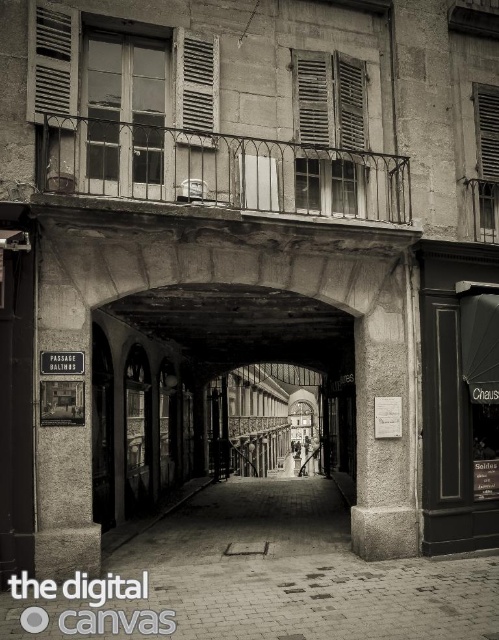
Question: Can you confirm if wooden slats at upper center is thinner than matte wood shutter at upper left?

Choices:
 (A) no
 (B) yes

Answer: (A)

Question: Estimate the real-world distances between objects in this image. Which object is farther from the smooth stone pillar at left?

Choices:
 (A) matte wood shutter at upper right
 (B) matte wood shutter at upper center

Answer: (A)

Question: Which object is positioned farthest from the white matte shutter at center?

Choices:
 (A) wooden slats at upper center
 (B) smooth stone pillar at left
 (C) matte wood shutter at upper right

Answer: (C)

Question: Among these objects, which one is farthest from the camera?

Choices:
 (A) smooth stone pillar at left
 (B) matte wood shutter at upper left

Answer: (B)

Question: Is smooth stone pillar at left thinner than matte wood shutter at upper center?

Choices:
 (A) yes
 (B) no

Answer: (B)

Question: Does matte wood shutter at upper right appear on the right side of white matte shutter at center?

Choices:
 (A) no
 (B) yes

Answer: (B)